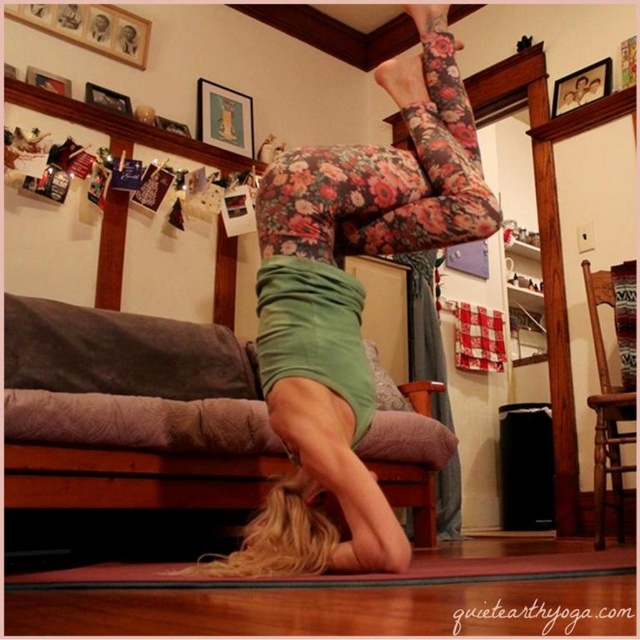
From the picture: Who is more distant from viewer, [397,80] or [253,580]?

The point [397,80] is more distant.

Is floral leggings at center closer to the viewer compared to red rubber mat at lower center?

No, it is not.

Locate an element on the screen. The height and width of the screenshot is (640, 640). floral leggings at center is located at coordinates (349, 307).

The height and width of the screenshot is (640, 640). In order to click on floral leggings at center in this screenshot , I will do `click(349, 307)`.